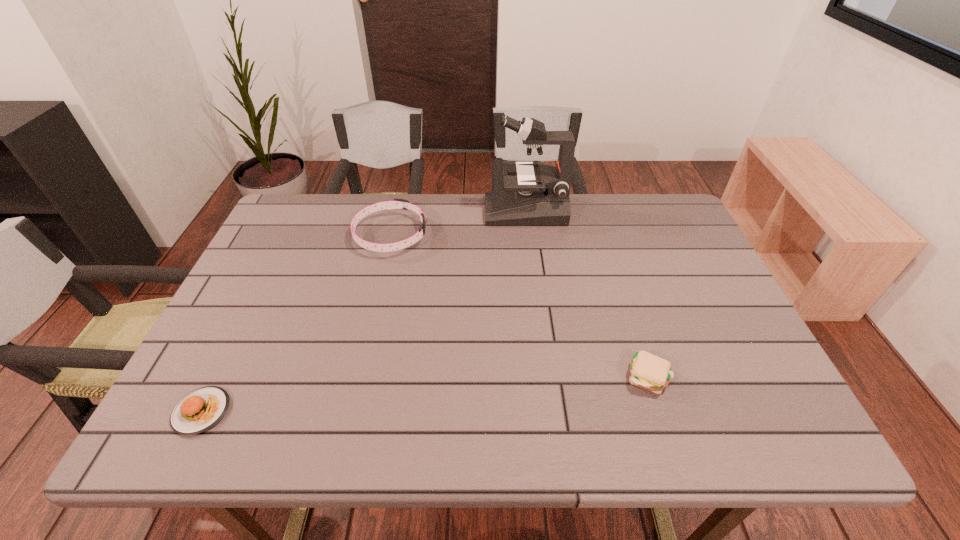
This screenshot has height=540, width=960. I want to click on vacant space at the near edge of the desktop, so click(406, 443).

Find the location of a particular element. free space at the left edge is located at coordinates (222, 349).

This screenshot has height=540, width=960. What are the coordinates of `free space at the right edge of the desktop` in the screenshot? It's located at (757, 369).

I want to click on vacant region at the far left corner of the desktop, so click(x=310, y=196).

This screenshot has width=960, height=540. In the image, there is a desktop. Find the location of `vacant space at the far right corner`. vacant space at the far right corner is located at coordinates (648, 197).

Where is `vacant space that is in between the dog collar and the microscope`? This screenshot has height=540, width=960. vacant space that is in between the dog collar and the microscope is located at coordinates [458, 223].

Locate an element on the screen. This screenshot has height=540, width=960. free space that is in between the taller food and the dog collar is located at coordinates click(519, 306).

You are a GUI agent. You are given a task and a screenshot of the screen. Output one action in this format:
    pyautogui.click(x=<x>, y=<y>)
    Task: Click on the free spot between the taller food and the third object from right to left
    
    Given the screenshot: What is the action you would take?
    pyautogui.click(x=519, y=306)

I want to click on empty space that is in between the rightmost object and the second object from left to right, so click(x=519, y=306).

What are the coordinates of `empty space that is in between the left food and the second tallest object` in the screenshot? It's located at (297, 323).